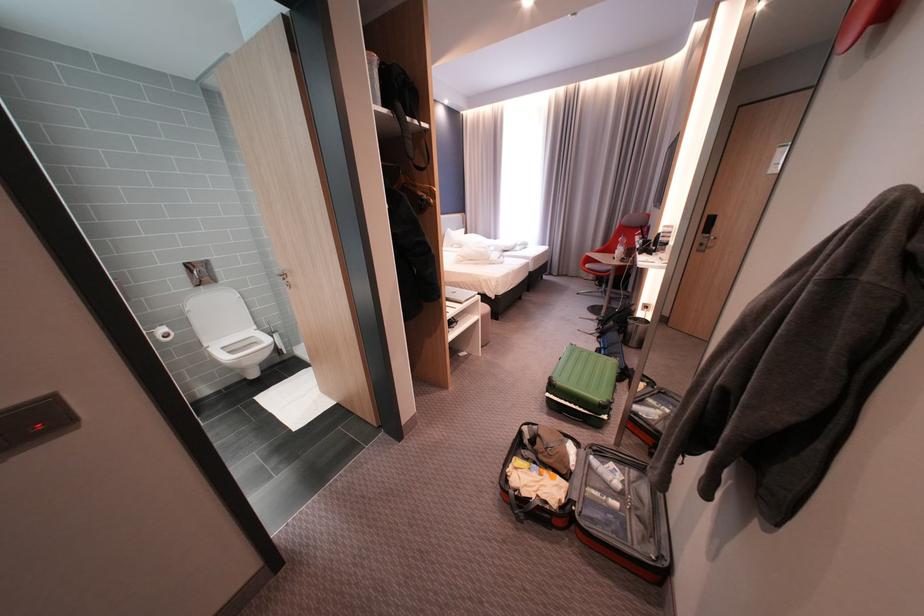
What do you see at coordinates (34, 422) in the screenshot?
I see `the black light switch` at bounding box center [34, 422].